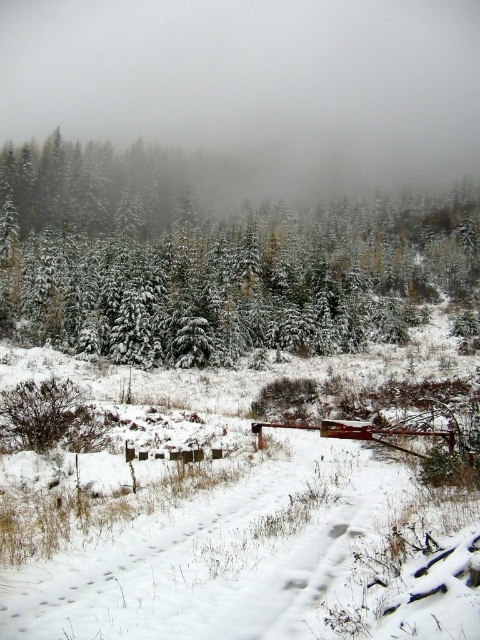
Does white foggy cloud at upper center appear on the left side of snow-covered evergreen trees at upper center?

In fact, white foggy cloud at upper center is to the right of snow-covered evergreen trees at upper center.

Can you confirm if white foggy cloud at upper center is wider than snow-covered evergreen trees at upper center?

Yes.

Who is more forward, (437, 147) or (201, 262)?

Point (201, 262) is more forward.

At what (x,y) coordinates should I click in order to perform the action: click on white foggy cloud at upper center. Please return your answer as a coordinate pair (x, y). The image size is (480, 640). Looking at the image, I should click on (254, 90).